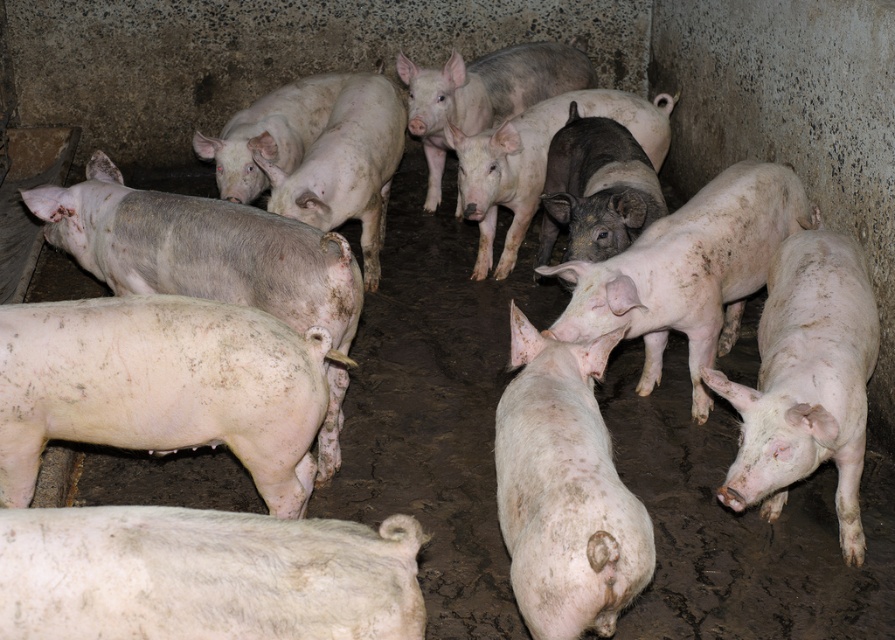
In the scene shown: What is located at the coordinates point (203, 573) in the image?

The point (203, 573) indicates a white matte pig at lower left.

Looking at this image, you are a farmer checking the pigs in the barn. You notice the white matte pig at lower left and the dirty white pig at center. Which pig is shorter?

The white matte pig at lower left is shorter than the dirty white pig at center.